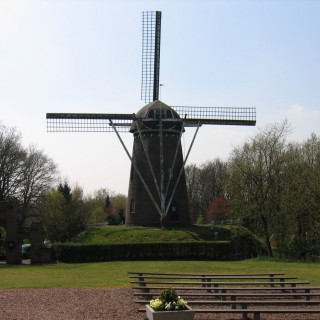
What are the coordinates of `brick wall` in the screenshot? It's located at (134, 255).